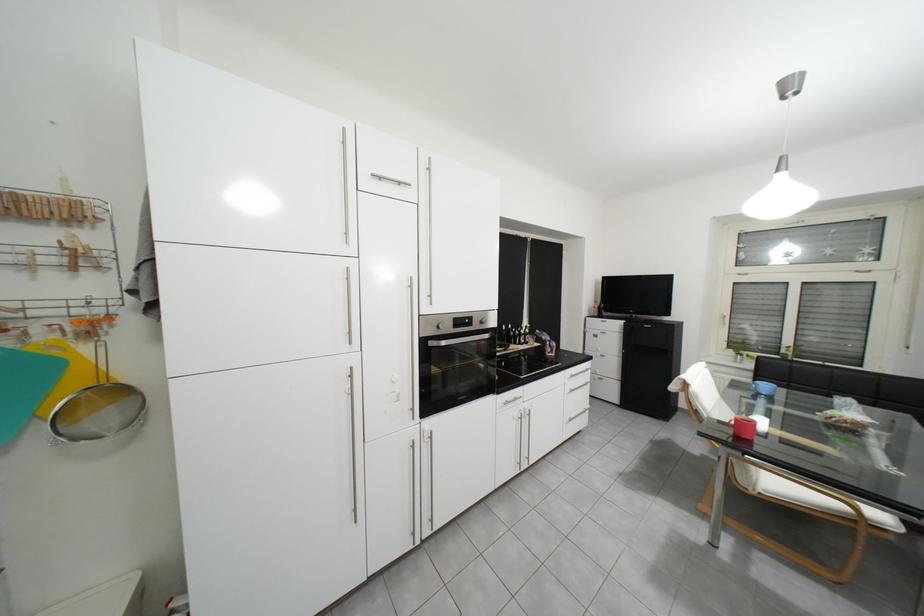
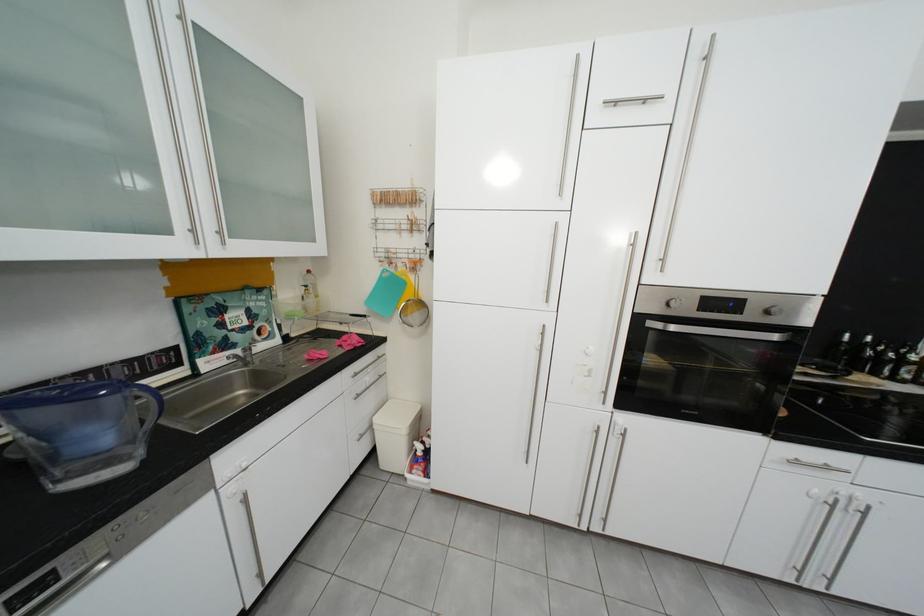
Locate, in the second image, the point that corresponds to (x=527, y=344) in the first image.

(886, 375)